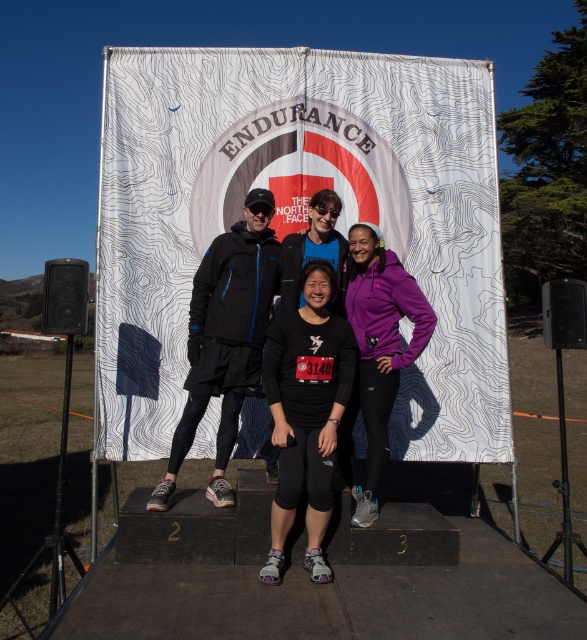
You are organizing a photo shoot and need to ensure that the two central athletes in the image are positioned so that their outfits are clearly visible. Given the black matte running outfit at center and the purple fleece jacket at center, which athlete should be placed slightly to the side to avoid overlapping their outfits?

The black matte running outfit at center should be placed slightly to the side because it has a lesser width compared to the purple fleece jacket at center, making it easier to adjust without overlapping.

You are a photographer setting up for an event photo. You need to ensure that all participants are visible in the frame. Given the two central participants wearing the black matte running outfit at center and the purple fleece jacket at center, which one might need to stand closer to the camera to ensure their full height is captured?

The black matte running outfit at center is shorter than the purple fleece jacket at center, so the shorter participant in the black matte running outfit at center should stand closer to the camera to ensure their full height is visible in the photo.

You are organizing a photo shoot and need to ensure that the two athletes in the center are positioned so that their outfits are clearly visible. Given that the black matte running outfit at center is smaller than the purple fleece jacket at center, which athlete should you move closer to the camera to make their outfit appear larger?

The athlete wearing the black matte running outfit at center should be moved closer to the camera because it has a smaller size compared to the purple fleece jacket at center, making it appear larger and more visible in the photo.